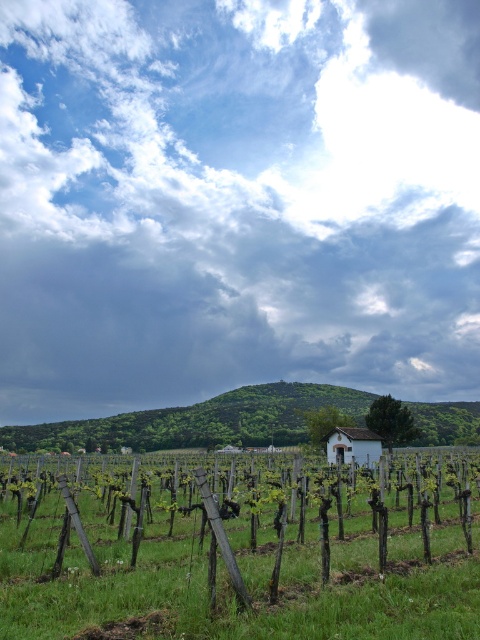
You are a landscape architect designing a new vineyard. You need to decide where to plant new grapevines. Considering the green grassy field at center and the green leafy hillside at center, which area has a higher elevation and is thus better suited for drainage?

The green grassy field at center has a greater height compared to the green leafy hillside at center, making it better suited for drainage due to its higher elevation.